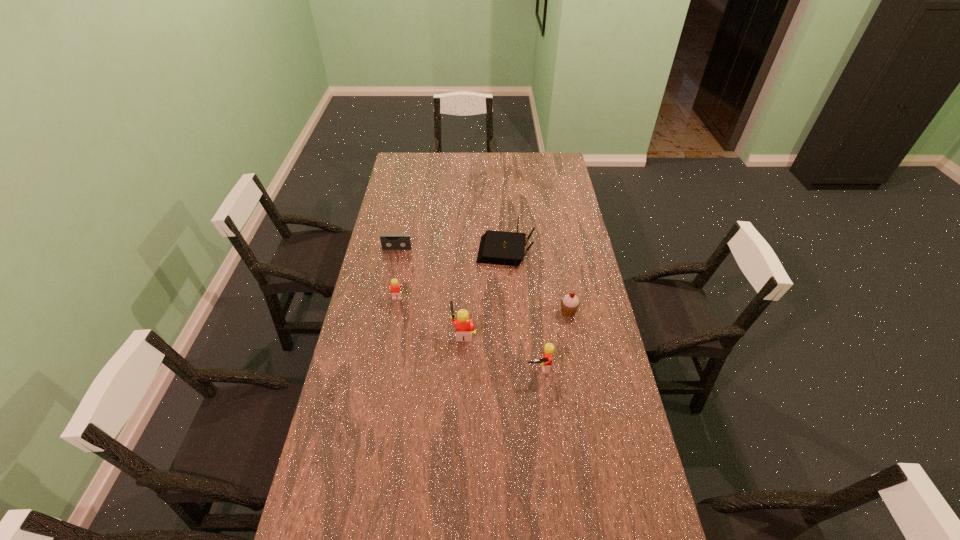
The image size is (960, 540). Identify the location of free point located 0.130m in front of the tallest object with the accessory visible. (415, 332).

Locate an element on the screen. blank space located in front of the tallest object with the accessory visible is located at coordinates (425, 332).

Image resolution: width=960 pixels, height=540 pixels. I want to click on free space located in front of the tallest object with the accessory visible, so click(376, 332).

The height and width of the screenshot is (540, 960). I want to click on vacant region located in front of the nearest Lego with the accessory visible, so click(550, 469).

Where is `free point located on the front of the router`? This screenshot has width=960, height=540. free point located on the front of the router is located at coordinates (511, 346).

Where is `blank space located on the front-facing side of the shortest object`? blank space located on the front-facing side of the shortest object is located at coordinates point(392,274).

Locate an element on the screen. free space located 0.120m on the back of the cupcake is located at coordinates (564, 282).

Where is `Lego present at the left edge`? Lego present at the left edge is located at coordinates (396, 289).

Where is `videotape that is at the left edge`? The image size is (960, 540). videotape that is at the left edge is located at coordinates (388, 241).

You are a GUI agent. You are given a task and a screenshot of the screen. Output one action in this format:
    pyautogui.click(x=<x>, y=<y>)
    Task: Click on the object that is at the right edge
    The image size is (960, 540).
    Given the screenshot: What is the action you would take?
    pyautogui.click(x=570, y=303)